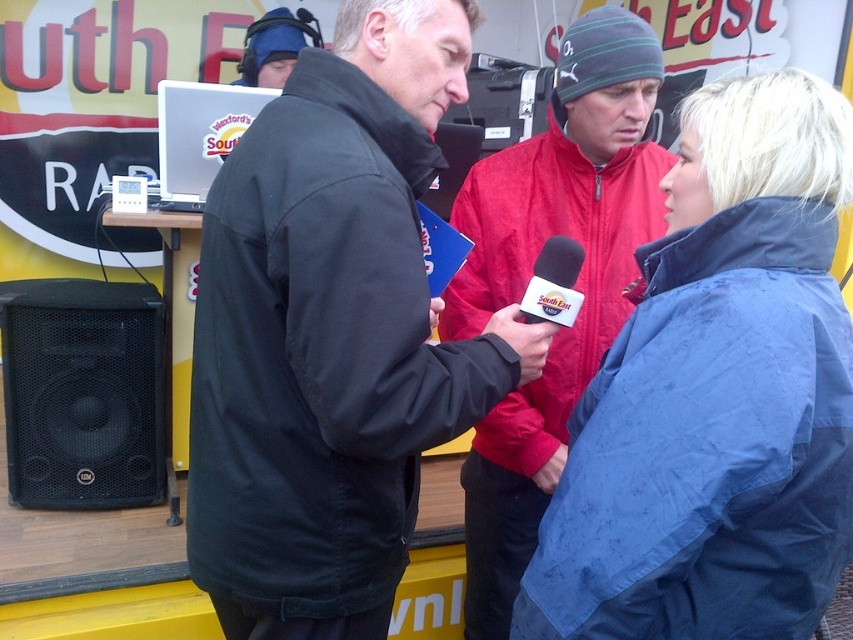
Question: Observing the image, what is the correct spatial positioning of red fleece jacket at center in reference to matte black microphone at center?

Choices:
 (A) below
 (B) above

Answer: (A)

Question: Among these points, which one is nearest to the camera?

Choices:
 (A) (787, 602)
 (B) (538, 148)

Answer: (A)

Question: Which object is closer to the camera taking this photo?

Choices:
 (A) black matte jacket at center
 (B) blue waterproof jacket at center
 (C) black matte speaker at lower left
 (D) matte blue glove at lower right

Answer: (B)

Question: Which of these objects is positioned closest to the black matte speaker at lower left?

Choices:
 (A) red fleece jacket at center
 (B) matte blue glove at lower right
 (C) blue waterproof jacket at center
 (D) black matte jacket at center

Answer: (A)

Question: Is black matte speaker at lower left thinner than matte black microphone at center?

Choices:
 (A) no
 (B) yes

Answer: (A)

Question: Where is red fleece jacket at center located in relation to matte blue glove at lower right in the image?

Choices:
 (A) below
 (B) above

Answer: (B)